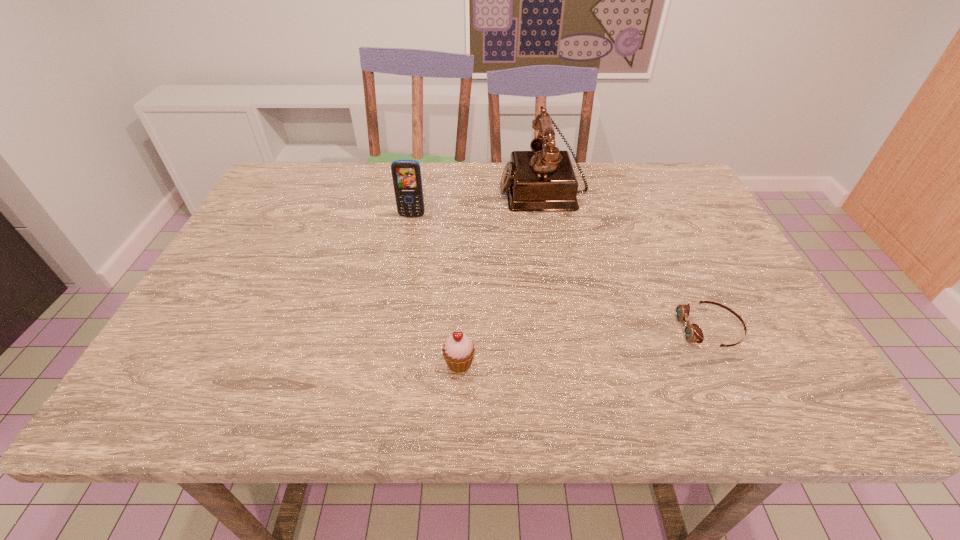
Find the location of a particular element. the third object from left to right is located at coordinates (543, 179).

I want to click on telephone, so click(543, 179).

The width and height of the screenshot is (960, 540). What are the coordinates of `the leftmost object` in the screenshot? It's located at (406, 174).

The image size is (960, 540). In order to click on the second tallest object in this screenshot , I will do `click(406, 174)`.

You are a GUI agent. You are given a task and a screenshot of the screen. Output one action in this format:
    pyautogui.click(x=<x>, y=<y>)
    Task: Click on the cupcake
    This screenshot has width=960, height=540.
    Given the screenshot: What is the action you would take?
    pyautogui.click(x=458, y=351)

This screenshot has height=540, width=960. In order to click on the second shortest object in this screenshot , I will do `click(458, 351)`.

Find the location of a particular element. The height and width of the screenshot is (540, 960). the rightmost object is located at coordinates (693, 333).

I want to click on goggles, so click(x=693, y=333).

Identify the location of vacant region located on the dial of the tallest object. (381, 188).

Where is `vacant space located 0.360m on the dial of the tallest object`? Image resolution: width=960 pixels, height=540 pixels. vacant space located 0.360m on the dial of the tallest object is located at coordinates (374, 188).